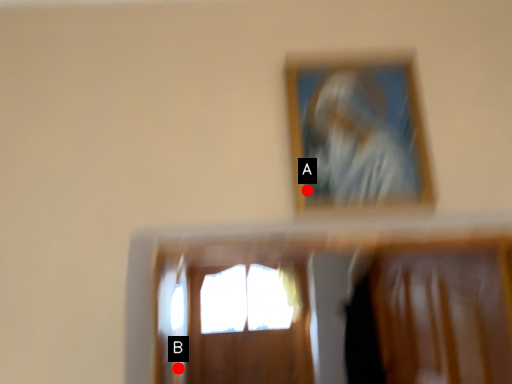
Question: Two points are circled on the image, labeled by A and B beside each circle. Which point is closer to the camera?

Choices:
 (A) A is closer
 (B) B is closer

Answer: (A)